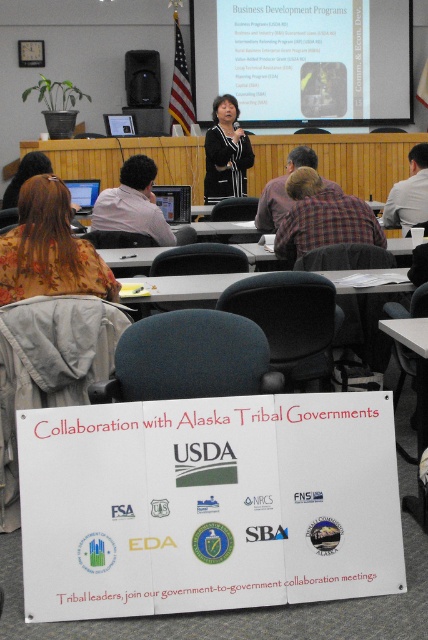
Is point (140, 230) less distant than point (133, 92)?

Yes, it is in front of point (133, 92).

Locate an element on the screen. The width and height of the screenshot is (428, 640). matte pink shirt at center is located at coordinates 133,204.

This screenshot has width=428, height=640. In order to click on matte pink shirt at center in this screenshot , I will do `click(133, 204)`.

How distant is white shirt at upper right from plaid shirt at center?

A distance of 3.39 feet exists between white shirt at upper right and plaid shirt at center.

Who is shorter, white shirt at upper right or plaid shirt at center?

plaid shirt at center is shorter.

At what (x,y) coordinates should I click in order to perform the action: click on white shirt at upper right. Please return your answer as a coordinate pair (x, y). The width and height of the screenshot is (428, 640). Looking at the image, I should click on (409, 193).

Is white shirt at upper right bigger than matte black speaker at upper center?

Correct, white shirt at upper right is larger in size than matte black speaker at upper center.

Does white shirt at upper right have a greater height compared to matte black speaker at upper center?

Yes.

Measure the distance between point (422, 186) and camera.

Point (422, 186) is 5.34 meters away from camera.

Image resolution: width=428 pixels, height=640 pixels. I want to click on white shirt at upper right, so click(x=409, y=193).